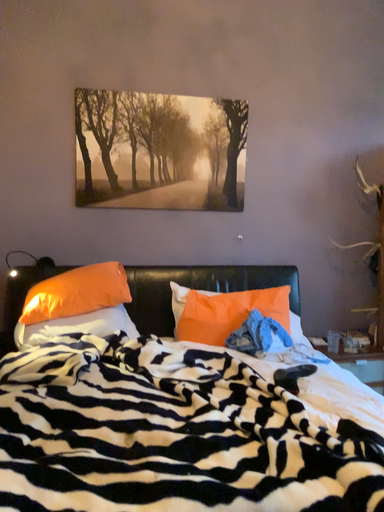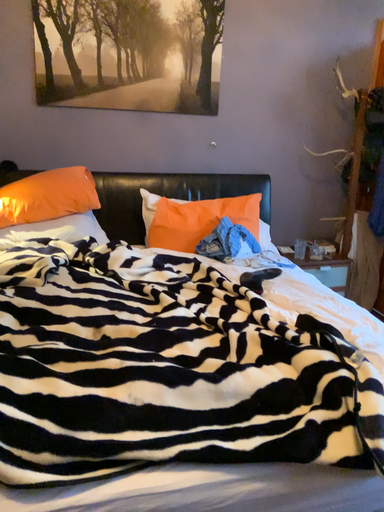
Question: How did the camera likely rotate when shooting the video?

Choices:
 (A) rotated downward
 (B) rotated upward

Answer: (A)